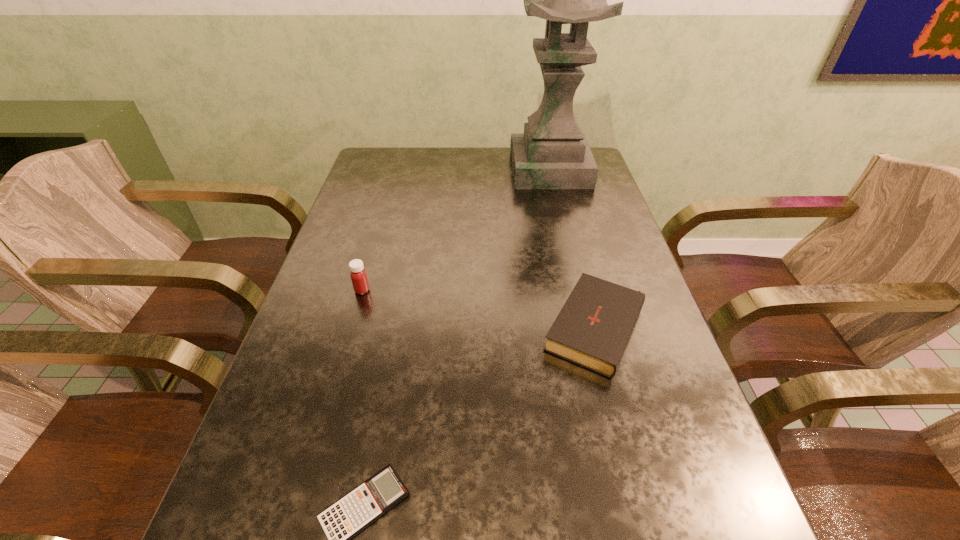
The image size is (960, 540). I want to click on free spot between the sculpture and the second tallest object, so click(x=456, y=230).

Find the location of a particular element. Image resolution: width=960 pixels, height=540 pixels. free space between the third tallest object and the farthest object is located at coordinates (574, 249).

Select which object appears as the third closest to the farthest object. Please provide its 2D coordinates. Your answer should be formatted as a tuple, i.e. [(x, y)], where the tuple contains the x and y coordinates of a point satisfying the conditions above.

[(343, 520)]

Locate which object is the third closest to the second shortest object. Please provide its 2D coordinates. Your answer should be formatted as a tuple, i.e. [(x, y)], where the tuple contains the x and y coordinates of a point satisfying the conditions above.

[(552, 153)]

At what (x,y) coordinates should I click in order to perform the action: click on vacant space that satisfies the following two spatial constraints: 1. at the front opening of the sculpture; 2. on the back side of the second shortest object. Please return your answer as a coordinate pair (x, y). Looking at the image, I should click on (588, 329).

Where is `vacant space that satisfies the following two spatial constraints: 1. at the front opening of the farthest object; 2. on the left side of the Bible`? Image resolution: width=960 pixels, height=540 pixels. vacant space that satisfies the following two spatial constraints: 1. at the front opening of the farthest object; 2. on the left side of the Bible is located at coordinates (588, 329).

Image resolution: width=960 pixels, height=540 pixels. What are the coordinates of `vacant space that satisfies the following two spatial constraints: 1. at the front opening of the farthest object; 2. on the back side of the Bible` in the screenshot? It's located at (588, 329).